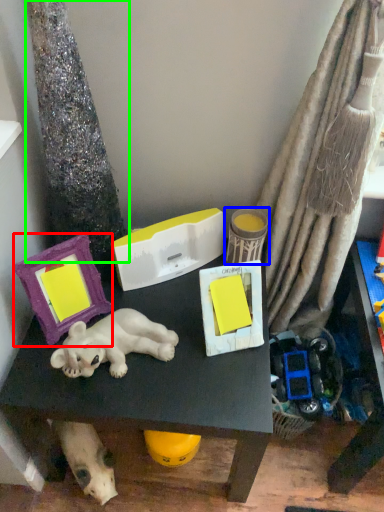
Question: Considering the real-world distances, which object is closest to picture frame (highlighted by a red box)? toy (highlighted by a blue box) or tree trunk (highlighted by a green box).

Choices:
 (A) toy
 (B) tree trunk

Answer: (B)